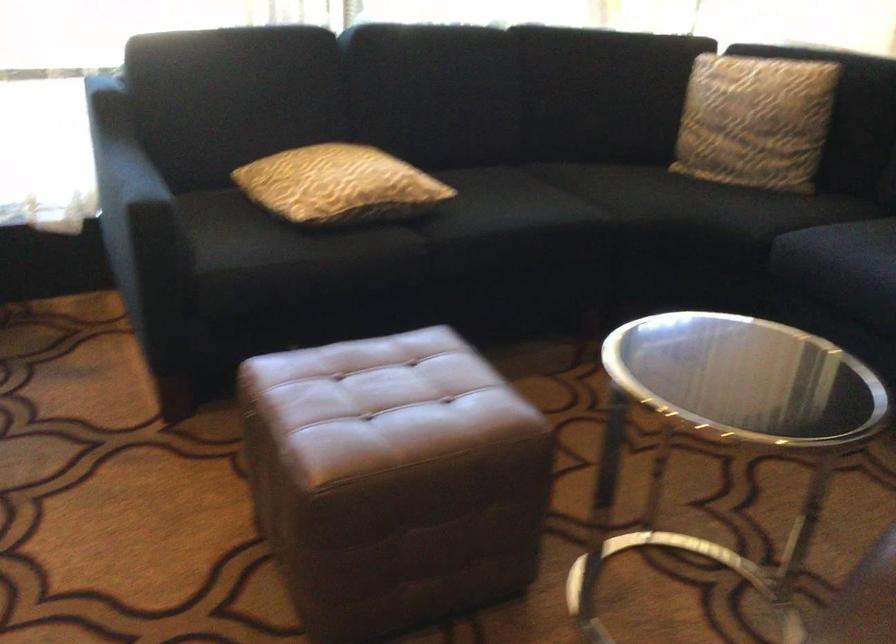
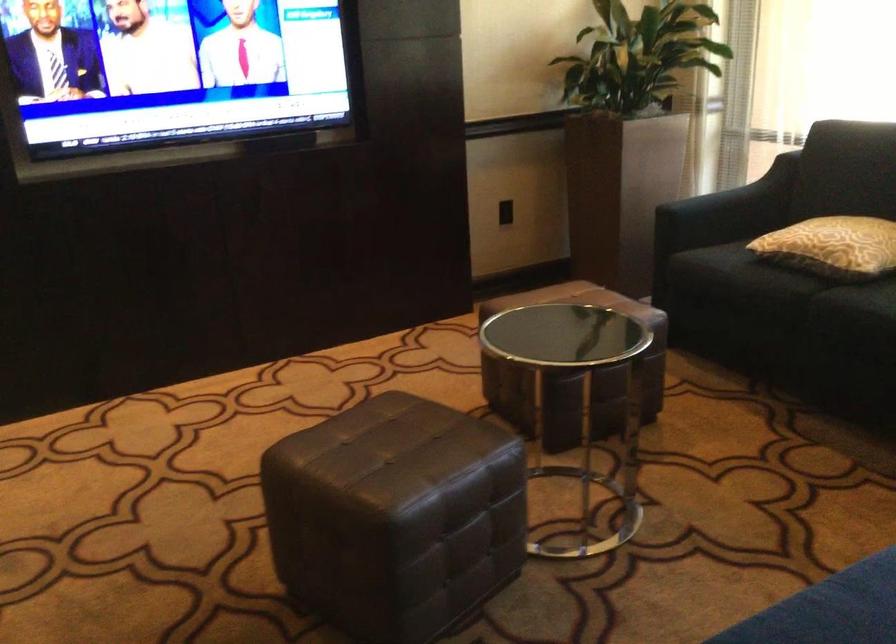
Find the pixel in the second image that matches point 154,175 in the first image.

(742, 196)